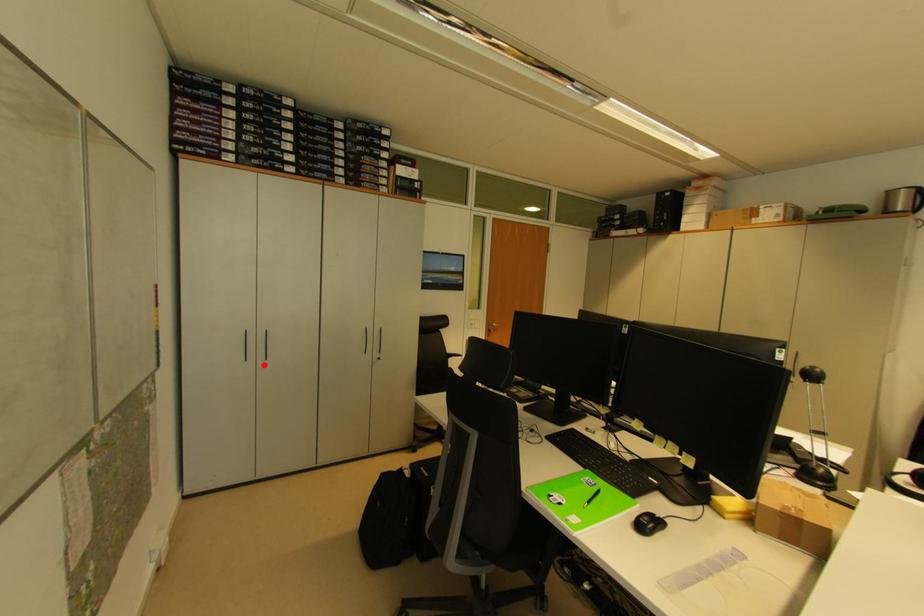
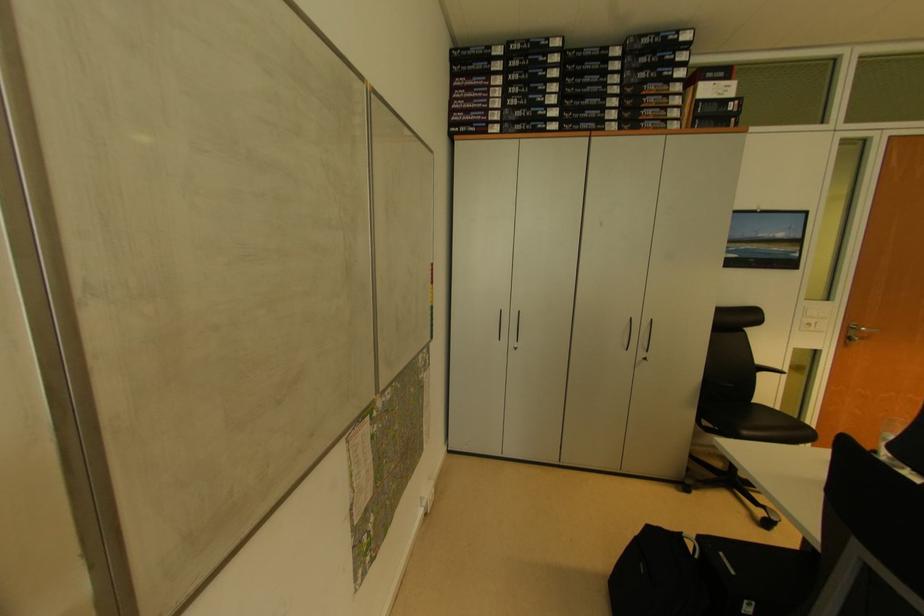
Find the pixel in the second image that matches the highlighted location in the first image.

(515, 346)